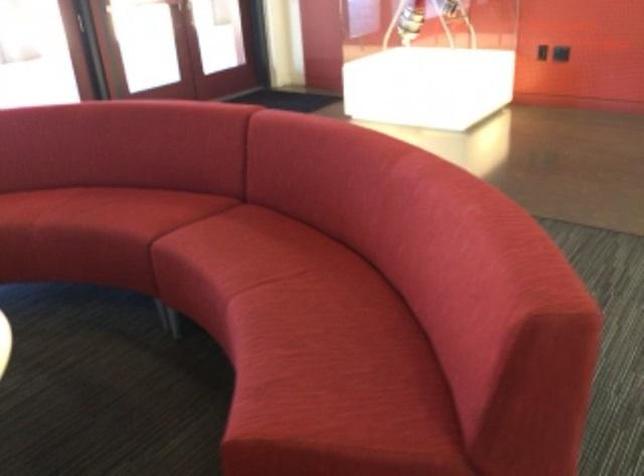
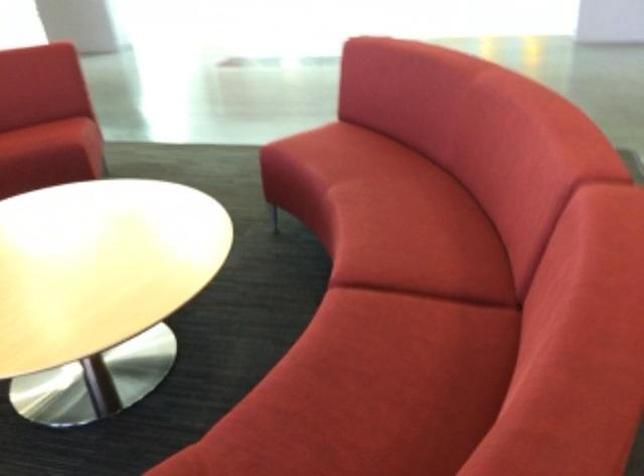
In the second image, find the point that corresponds to (303,368) in the first image.

(46, 136)